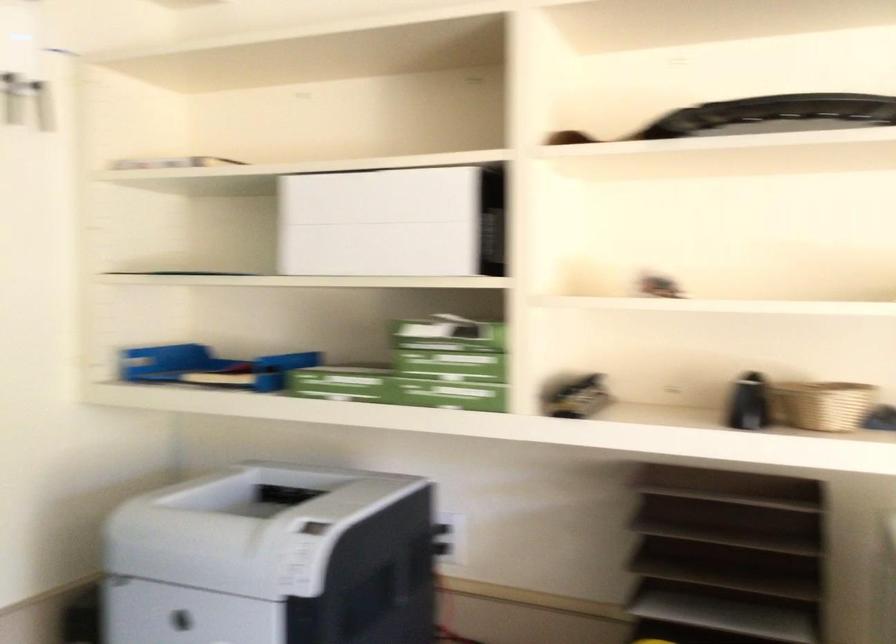
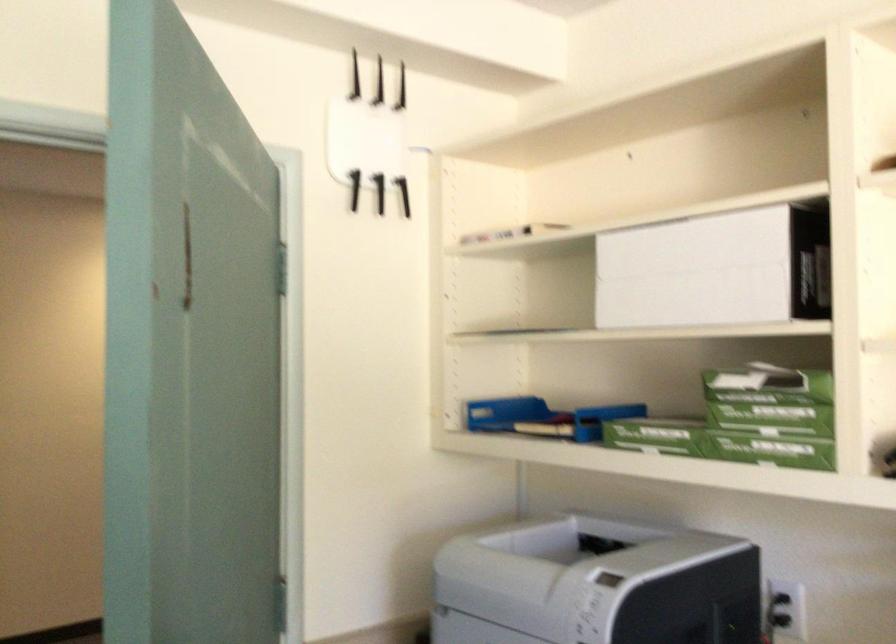
Where in the second image is the point corresponding to pixel 443 531 from the first image?

(782, 609)